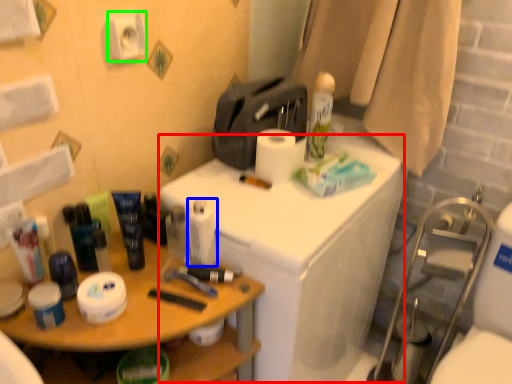
Question: Which is nearer to the counter (highlighted by a red box)? toilet paper (highlighted by a blue box) or toilet paper (highlighted by a green box).

Choices:
 (A) toilet paper
 (B) toilet paper

Answer: (A)